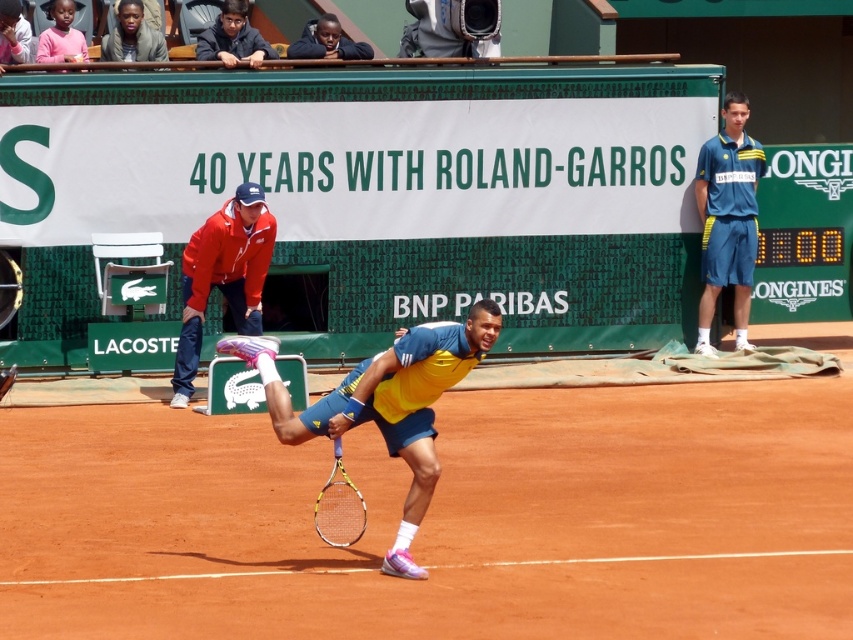
Does matte red jacket at upper left appear over dark blue jacket at upper center?

Actually, matte red jacket at upper left is below dark blue jacket at upper center.

Can you confirm if matte red jacket at upper left is smaller than dark blue jacket at upper center?

No, matte red jacket at upper left is not smaller than dark blue jacket at upper center.

Who is more forward, (235, 252) or (369, 45)?

Positioned in front is point (235, 252).

You are a GUI agent. You are given a task and a screenshot of the screen. Output one action in this format:
    pyautogui.click(x=<x>, y=<y>)
    Task: Click on the matte red jacket at upper left
    
    Given the screenshot: What is the action you would take?
    pyautogui.click(x=223, y=276)

Can you confirm if blue fabric shorts at right is positioned below yellow and black racket at center?

No, blue fabric shorts at right is not below yellow and black racket at center.

Does blue fabric shorts at right appear on the right side of yellow and black racket at center?

Indeed, blue fabric shorts at right is positioned on the right side of yellow and black racket at center.

Find the location of a particular element. The width and height of the screenshot is (853, 640). blue fabric shorts at right is located at coordinates tap(727, 218).

Where is `blue fabric shorts at right`? This screenshot has height=640, width=853. blue fabric shorts at right is located at coordinates (727, 218).

Is the position of blue fabric shorts at right more distant than that of matte red jacket at upper left?

Yes, blue fabric shorts at right is further from the viewer.

Can you confirm if blue fabric shorts at right is shorter than matte red jacket at upper left?

Incorrect, blue fabric shorts at right's height does not fall short of matte red jacket at upper left's.

Who is more distant from viewer, (697,193) or (196,276)?

Positioned behind is point (697,193).

The image size is (853, 640). In order to click on blue fabric shorts at right in this screenshot , I will do `click(727, 218)`.